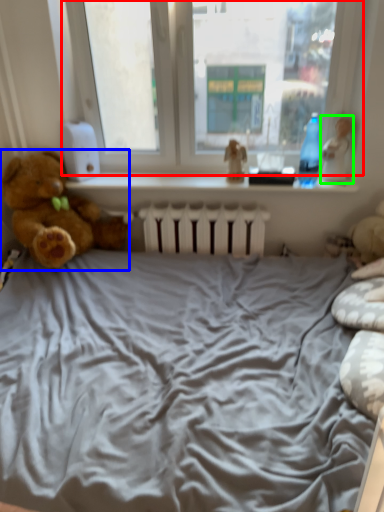
Question: Considering the real-world distances, which object is farthest from window (highlighted by a red box)? teddy bear (highlighted by a blue box) or toy (highlighted by a green box)?

Choices:
 (A) teddy bear
 (B) toy

Answer: (A)